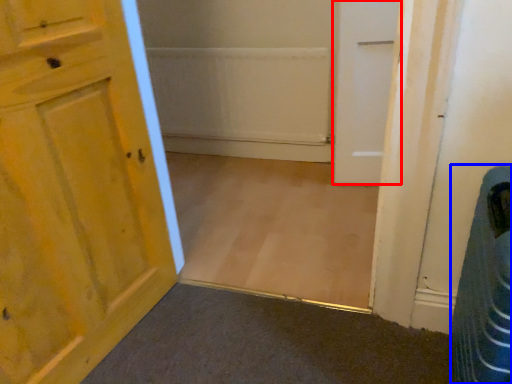
Question: Which of the following is the farthest to the observer, door (highlighted by a red box) or laundry basket (highlighted by a blue box)?

Choices:
 (A) door
 (B) laundry basket

Answer: (A)